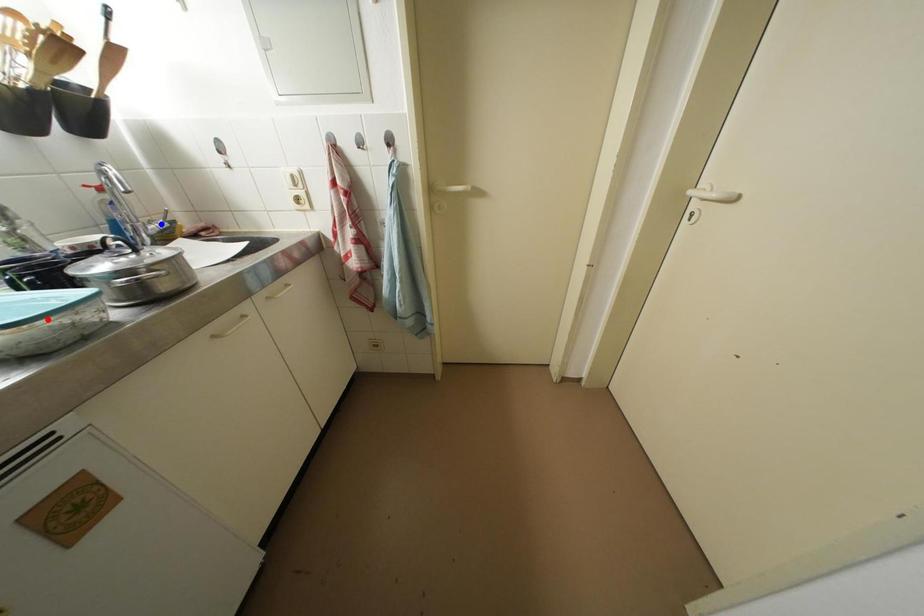
Question: Which of the two points in the image is closer to the camera?

Choices:
 (A) Blue point is closer.
 (B) Red point is closer.

Answer: (B)